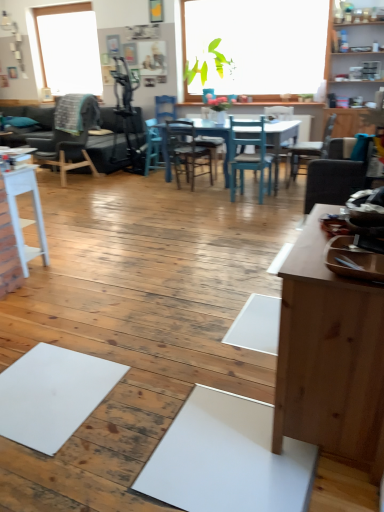
Question: Can you confirm if wooden chair at right, the 1th chair viewed from the right, is wider than dark brown wooden chair at left, the sixth chair when ordered from right to left?

Choices:
 (A) no
 (B) yes

Answer: (A)

Question: Considering the relative sizes of wooden chair at right, the 6th chair positioned from the left, and dark brown wooden chair at left, the sixth chair when ordered from right to left, in the image provided, is wooden chair at right, the 6th chair positioned from the left, taller than dark brown wooden chair at left, the sixth chair when ordered from right to left,?

Choices:
 (A) yes
 (B) no

Answer: (B)

Question: Considering the relative sizes of wooden chair at right, the 1th chair viewed from the right, and dark brown wooden chair at left, which is the first chair in left-to-right order, in the image provided, is wooden chair at right, the 1th chair viewed from the right, smaller than dark brown wooden chair at left, which is the first chair in left-to-right order,?

Choices:
 (A) no
 (B) yes

Answer: (B)

Question: Can you confirm if wooden chair at right, the 1th chair viewed from the right, is bigger than dark brown wooden chair at left, which is the first chair in left-to-right order?

Choices:
 (A) no
 (B) yes

Answer: (A)

Question: Is the position of wooden chair at right, the 6th chair positioned from the left, more distant than that of dark brown wooden chair at left, the sixth chair when ordered from right to left?

Choices:
 (A) no
 (B) yes

Answer: (A)

Question: Can dark brown wooden chair at left, which is the first chair in left-to-right order, be found inside wooden chair at right, the 1th chair viewed from the right?

Choices:
 (A) yes
 (B) no

Answer: (B)

Question: From a real-world perspective, is white matte table at left on top of wooden cabinet at upper right?

Choices:
 (A) no
 (B) yes

Answer: (A)

Question: Is white matte table at left in contact with wooden cabinet at upper right?

Choices:
 (A) yes
 (B) no

Answer: (B)

Question: From the image's perspective, is white matte table at left beneath wooden cabinet at upper right?

Choices:
 (A) yes
 (B) no

Answer: (A)

Question: From the image's perspective, does white matte table at left appear higher than wooden cabinet at upper right?

Choices:
 (A) no
 (B) yes

Answer: (A)

Question: Is white matte table at left surrounding wooden cabinet at upper right?

Choices:
 (A) no
 (B) yes

Answer: (A)

Question: Can you confirm if white matte table at left is positioned to the left of wooden cabinet at upper right?

Choices:
 (A) yes
 (B) no

Answer: (A)

Question: Does blue wood chair at center, which is the fifth chair in right-to-left order, have a lesser height compared to teal wood chair at center, the fourth chair from the left?

Choices:
 (A) no
 (B) yes

Answer: (B)